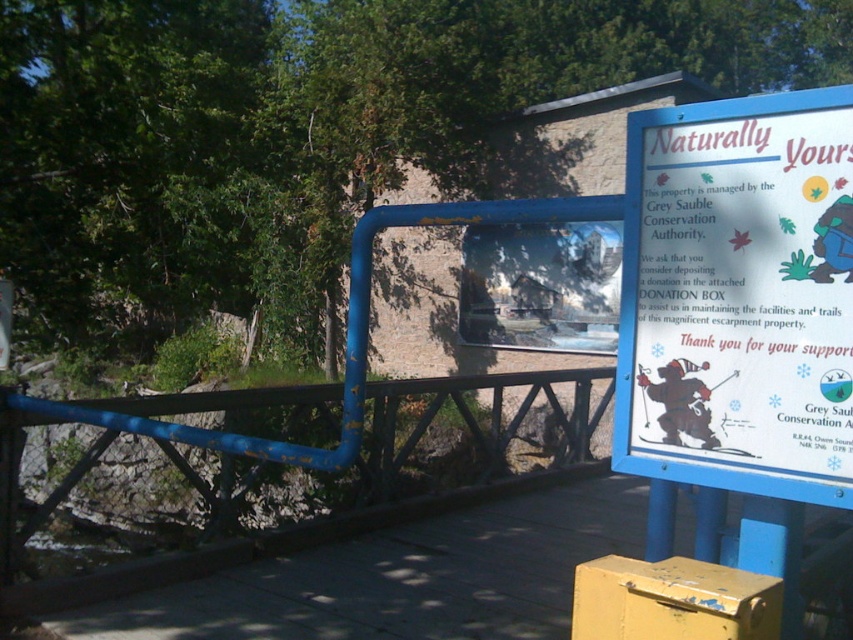
Question: Does white paper sign at upper right have a lesser width compared to blue painted metal rail at center?

Choices:
 (A) yes
 (B) no

Answer: (B)

Question: Does white paper sign at upper right have a lesser width compared to blue painted metal rail at center?

Choices:
 (A) yes
 (B) no

Answer: (B)

Question: Which of the following is the closest to the observer?

Choices:
 (A) (654, 464)
 (B) (343, 524)

Answer: (A)

Question: Can you confirm if white paper sign at upper right is smaller than blue painted metal rail at center?

Choices:
 (A) no
 (B) yes

Answer: (A)